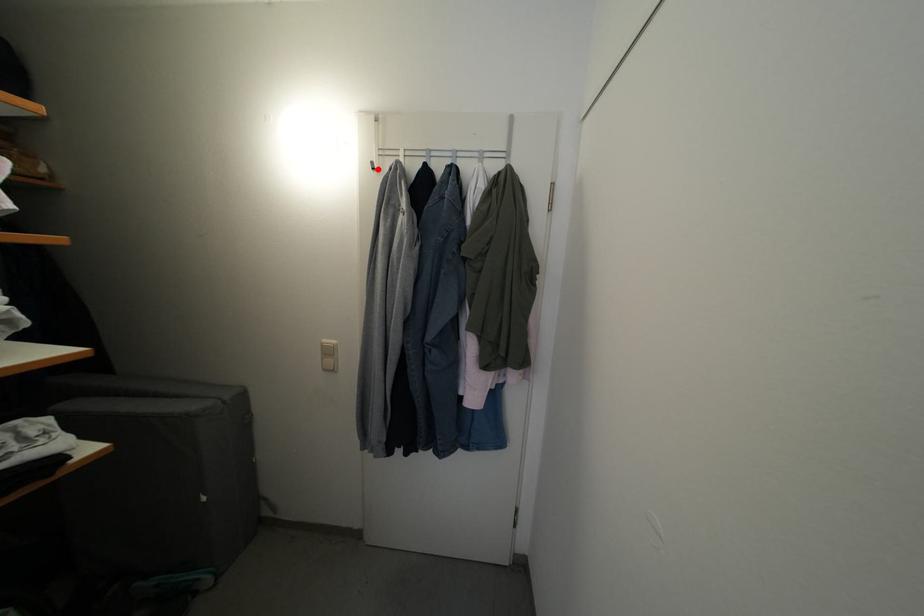
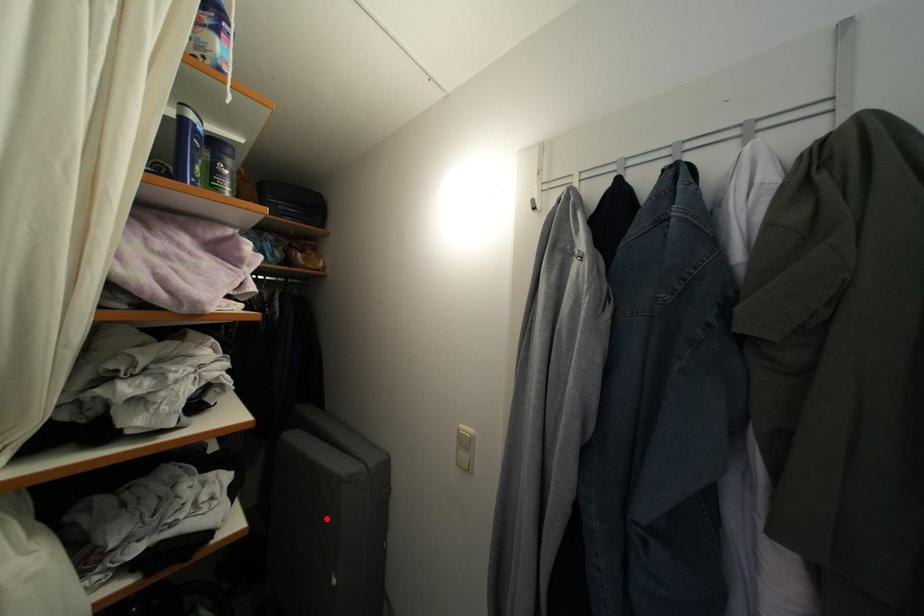
I am providing you with two images of the same scene from different viewpoints. A red point is marked on the first image and another point is marked on the second image. Do the highlighted points in image1 and image2 indicate the same real-world spot?

No